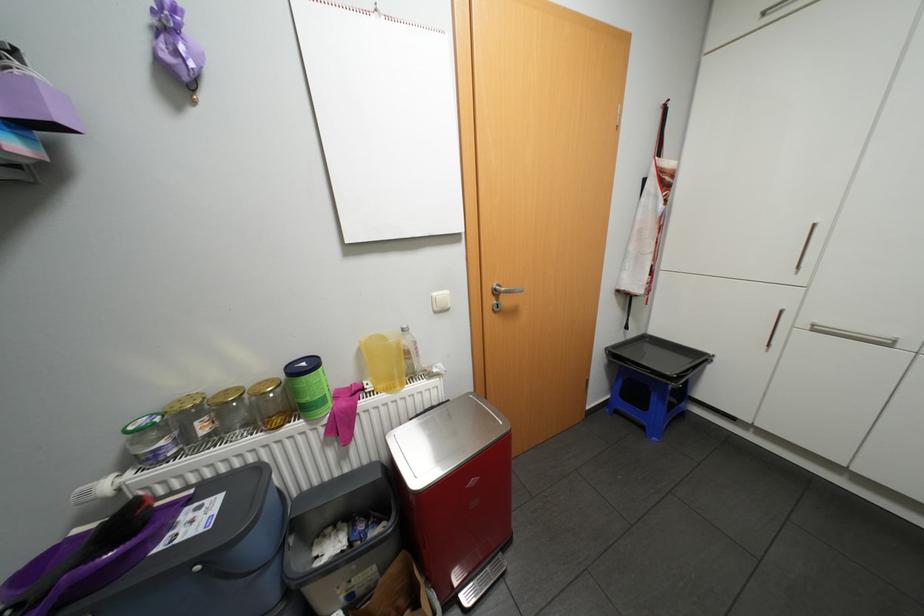
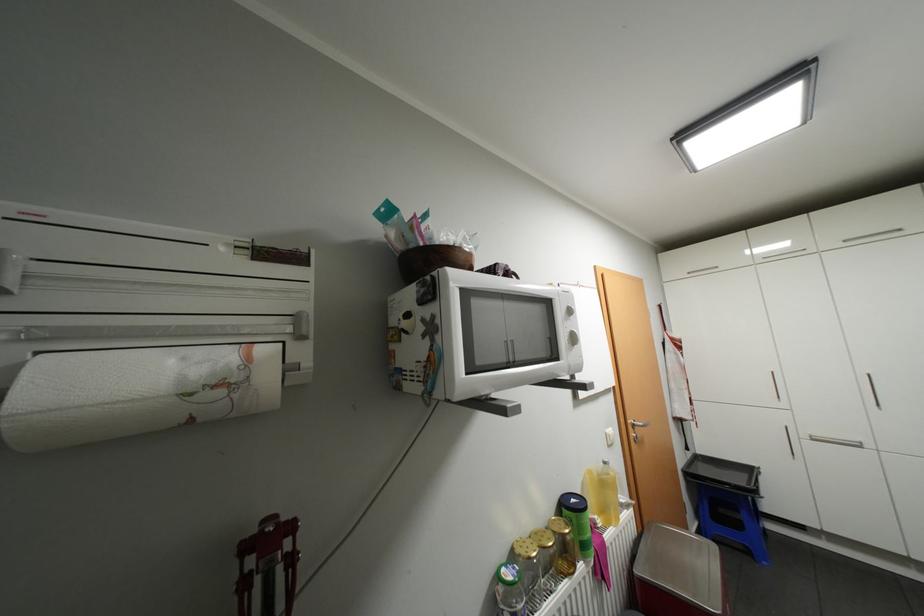
Locate, in the second image, the point that corresponds to point (823, 329) in the first image.

(821, 438)